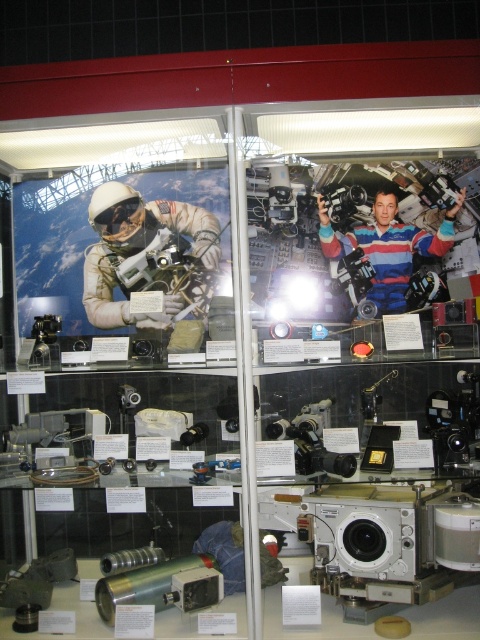
Can you confirm if matte white spacesuit at center is shorter than striped fabric astronaut at center?

Incorrect, matte white spacesuit at center's height does not fall short of striped fabric astronaut at center's.

Is matte white spacesuit at center wider than striped fabric astronaut at center?

No, matte white spacesuit at center is not wider than striped fabric astronaut at center.

What do you see at coordinates (146, 257) in the screenshot? This screenshot has width=480, height=640. I see `matte white spacesuit at center` at bounding box center [146, 257].

Identify the location of matte white spacesuit at center. (146, 257).